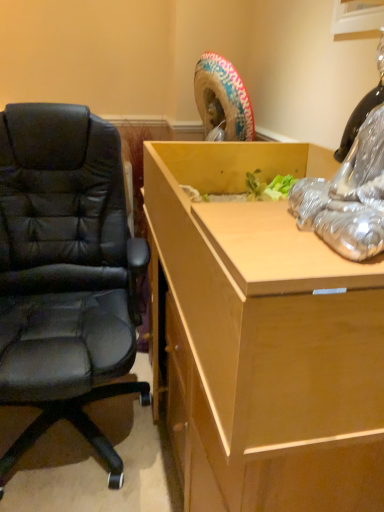
Where is `black leather chair at left`? Image resolution: width=384 pixels, height=512 pixels. black leather chair at left is located at coordinates (65, 272).

What is the approximate height of black leather chair at left?

The height of black leather chair at left is 99.67 centimeters.

The height and width of the screenshot is (512, 384). What do you see at coordinates (65, 272) in the screenshot?
I see `black leather chair at left` at bounding box center [65, 272].

In order to face light brown wood desk at center, should I rotate leftwards or rightwards?

You should look right and rotate roughly 12.302 degrees.

Locate an element on the screen. Image resolution: width=384 pixels, height=512 pixels. light brown wood desk at center is located at coordinates (263, 339).

The image size is (384, 512). What do you see at coordinates (263, 339) in the screenshot?
I see `light brown wood desk at center` at bounding box center [263, 339].

Measure the distance between point (196, 390) and camera.

A distance of 3.42 feet exists between point (196, 390) and camera.

I want to click on black leather chair at left, so click(x=65, y=272).

Can you confirm if light brown wood desk at center is positioned to the right of black leather chair at left?

Yes, light brown wood desk at center is to the right of black leather chair at left.

Does light brown wood desk at center come behind black leather chair at left?

No, light brown wood desk at center is closer to the camera.

Is point (270, 414) positioned after point (114, 297)?

No, (270, 414) is closer to viewer.

Based on the photo, from the image's perspective, is light brown wood desk at center beneath black leather chair at left?

No.

From a real-world perspective, is light brown wood desk at center positioned above or below black leather chair at left?

Clearly, from a real-world perspective, light brown wood desk at center is above black leather chair at left.

In terms of width, does light brown wood desk at center look wider or thinner when compared to black leather chair at left?

light brown wood desk at center is thinner than black leather chair at left.

Considering the relative sizes of light brown wood desk at center and black leather chair at left in the image provided, is light brown wood desk at center taller than black leather chair at left?

In fact, light brown wood desk at center may be shorter than black leather chair at left.

From the picture: Considering the sizes of objects light brown wood desk at center and black leather chair at left in the image provided, who is bigger, light brown wood desk at center or black leather chair at left?

black leather chair at left.

Is light brown wood desk at center positioned beyond the bounds of black leather chair at left?

Indeed, light brown wood desk at center is completely outside black leather chair at left.

Is light brown wood desk at center next to black leather chair at left and touching it?

No, light brown wood desk at center is not making contact with black leather chair at left.

Is light brown wood desk at center looking in the opposite direction of black leather chair at left?

light brown wood desk at center does not have its back to black leather chair at left.

Can you tell me how much light brown wood desk at center and black leather chair at left differ in facing direction?

The facing directions of light brown wood desk at center and black leather chair at left are 89.9 degrees apart.

Locate an element on the screen. This screenshot has height=512, width=384. desk that appears above the black leather chair at left (from a real-world perspective) is located at coordinates (263, 339).

Considering the relative positions of black leather chair at left and light brown wood desk at center in the image provided, is black leather chair at left to the right of light brown wood desk at center from the viewer's perspective?

Incorrect, black leather chair at left is not on the right side of light brown wood desk at center.

Which is behind, black leather chair at left or light brown wood desk at center?

black leather chair at left is further away from the camera.

Is point (52, 379) farther from viewer compared to point (288, 495)?

Yes, it is behind point (288, 495).

From the image's perspective, relative to light brown wood desk at center, is black leather chair at left above or below?

black leather chair at left is below light brown wood desk at center.

From a real-world perspective, is black leather chair at left positioned above or below light brown wood desk at center?

black leather chair at left is situated lower than light brown wood desk at center in the real world.

Looking at their sizes, would you say black leather chair at left is wider or thinner than light brown wood desk at center?

In the image, black leather chair at left appears to be wider than light brown wood desk at center.

Can you confirm if black leather chair at left is taller than light brown wood desk at center?

Yes, black leather chair at left is taller than light brown wood desk at center.

Who is bigger, black leather chair at left or light brown wood desk at center?

Bigger between the two is black leather chair at left.

Is light brown wood desk at center completely or partially inside black leather chair at left?

Definitely not — light brown wood desk at center is not inside black leather chair at left.

Would you consider black leather chair at left to be distant from light brown wood desk at center?

No, black leather chair at left is not far away from light brown wood desk at center.

Could you tell me if black leather chair at left is turned towards light brown wood desk at center?

No, black leather chair at left does not turn towards light brown wood desk at center.

Where is `chair that is behind the light brown wood desk at center`? chair that is behind the light brown wood desk at center is located at coordinates (65, 272).

This screenshot has width=384, height=512. Find the location of `chair below the light brown wood desk at center (from the image's perspective)`. chair below the light brown wood desk at center (from the image's perspective) is located at coordinates (65, 272).

Where is `desk in front of the black leather chair at left`? This screenshot has height=512, width=384. desk in front of the black leather chair at left is located at coordinates (263, 339).